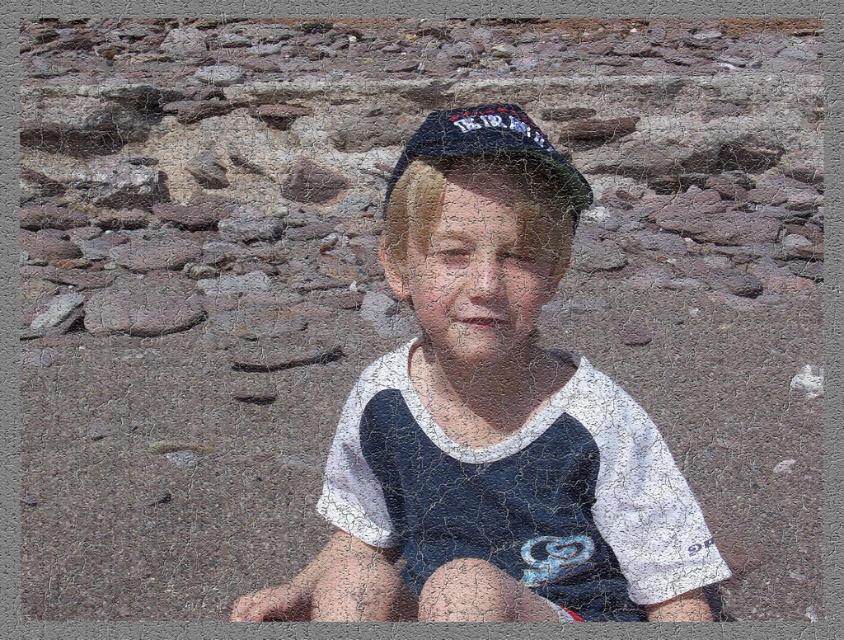
Question: Does white cotton shirt at center appear on the left side of dark blue fabric baseball hat at center?

Choices:
 (A) yes
 (B) no

Answer: (A)

Question: Can you confirm if white cotton shirt at center is smaller than dark blue fabric baseball hat at center?

Choices:
 (A) yes
 (B) no

Answer: (B)

Question: From the image, what is the correct spatial relationship of white cotton shirt at center in relation to dark blue fabric baseball hat at center?

Choices:
 (A) right
 (B) left

Answer: (B)

Question: Among these points, which one is farthest from the camera?

Choices:
 (A) (431, 205)
 (B) (452, 113)

Answer: (B)